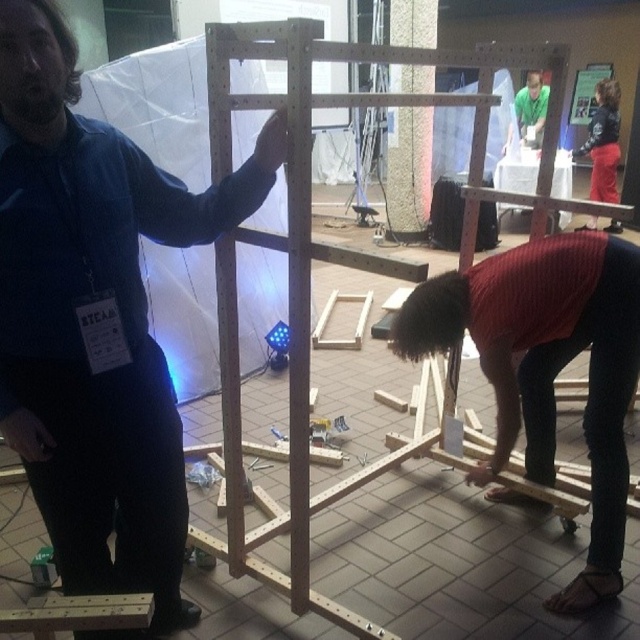
Question: Considering the real-world distances, which object is farthest from the knit red sweater at lower center?

Choices:
 (A) red fabric skirt at lower right
 (B) natural wood easel at center

Answer: (A)

Question: In this image, where is natural wood easel at center located relative to knit red sweater at lower center?

Choices:
 (A) above
 (B) below

Answer: (A)

Question: Can you confirm if blue fabric shirt at upper left is positioned to the right of red fabric skirt at lower right?

Choices:
 (A) no
 (B) yes

Answer: (A)

Question: Which object is positioned farthest from the blue fabric shirt at upper left?

Choices:
 (A) red fabric skirt at lower right
 (B) natural wood easel at center
 (C) knit red sweater at lower center

Answer: (A)

Question: Is blue fabric shirt at upper left closer to the viewer compared to red fabric skirt at lower right?

Choices:
 (A) no
 (B) yes

Answer: (B)

Question: Which point appears closest to the camera in this image?

Choices:
 (A) (305, 449)
 (B) (493, 285)

Answer: (A)